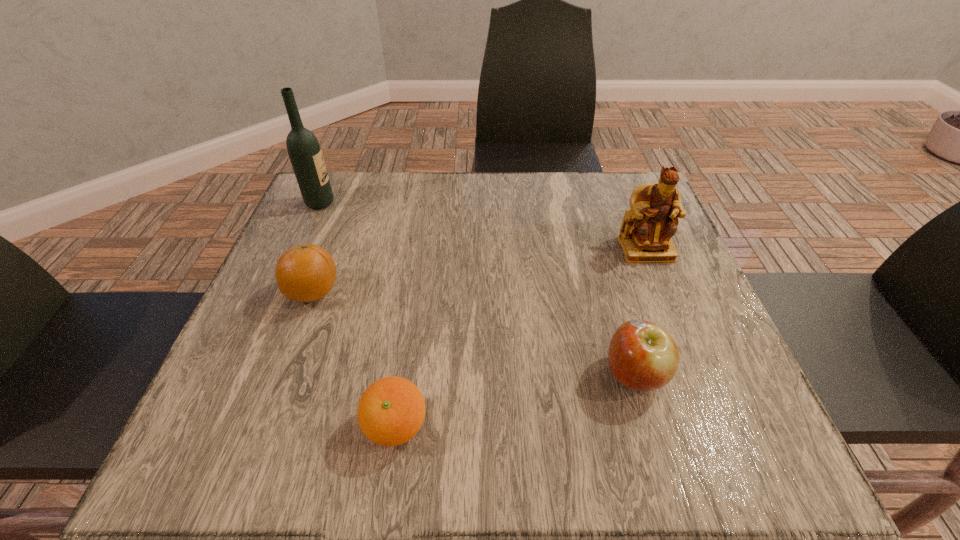
Find the location of a particular element. vacant region located 0.260m on the front-facing side of the second tallest object is located at coordinates (691, 364).

Locate an element on the screen. This screenshot has width=960, height=540. free location located 0.180m on the back of the left orange is located at coordinates (340, 221).

The width and height of the screenshot is (960, 540). Identify the location of free space located 0.300m on the back of the apple. (596, 241).

I want to click on vacant space located on the right of the shorter orange, so click(x=460, y=426).

Find the location of `object that is at the far edge`. object that is at the far edge is located at coordinates (304, 151).

This screenshot has height=540, width=960. What are the coordinates of `object present at the near edge` in the screenshot? It's located at (391, 411).

Identify the location of wine bottle present at the left edge. (304, 151).

The image size is (960, 540). Identify the location of orange located at the left edge. (304, 273).

Where is `figurine that is at the right edge`? This screenshot has width=960, height=540. figurine that is at the right edge is located at coordinates (645, 235).

This screenshot has height=540, width=960. Identify the location of apple positioned at the right edge. (643, 356).